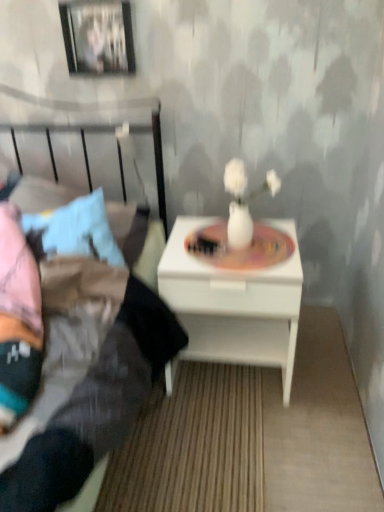
Locate an element on the screen. The width and height of the screenshot is (384, 512). matte black bed at left is located at coordinates (83, 378).

Find the location of a particular element. matte black bed at left is located at coordinates (83, 378).

Is metallic silver picture frame at upper left located outside matte black bed at left?

Indeed, metallic silver picture frame at upper left is completely outside matte black bed at left.

Which of these two, metallic silver picture frame at upper left or matte black bed at left, stands shorter?

metallic silver picture frame at upper left is shorter.

From the picture: From a real-world perspective, between metallic silver picture frame at upper left and matte black bed at left, who is vertically higher?

metallic silver picture frame at upper left, from a real-world perspective.

Is metallic silver picture frame at upper left aimed at matte black bed at left?

No, metallic silver picture frame at upper left does not turn towards matte black bed at left.

Who is taller, matte white vase at center or metallic silver picture frame at upper left?

With more height is metallic silver picture frame at upper left.

This screenshot has width=384, height=512. In order to click on picture frame above the matte white vase at center (from the image's perspective) in this screenshot , I will do `click(98, 37)`.

Considering the relative sizes of matte white vase at center and metallic silver picture frame at upper left in the image provided, is matte white vase at center bigger than metallic silver picture frame at upper left?

No.

Which object is positioned more to the right, metallic silver picture frame at upper left or matte white vase at center?

matte white vase at center is more to the right.

Is metallic silver picture frame at upper left not near matte white vase at center?

That's not correct — metallic silver picture frame at upper left is a little close to matte white vase at center.

Considering the sizes of objects metallic silver picture frame at upper left and matte white vase at center in the image provided, who is bigger, metallic silver picture frame at upper left or matte white vase at center?

Bigger between the two is metallic silver picture frame at upper left.

From the image's perspective, which is above, metallic silver picture frame at upper left or matte white vase at center?

metallic silver picture frame at upper left appears higher in the image.

Consider the image. Is matte black bed at left to the right of matte white vase at center from the viewer's perspective?

No.

Is matte black bed at left smaller than matte white vase at center?

No.

Are matte black bed at left and matte white vase at center making contact?

No, matte black bed at left is not making contact with matte white vase at center.

What's the angular difference between white glossy nightstand at center and metallic silver picture frame at upper left's facing directions?

There is a 0.855-degree angle between the facing directions of white glossy nightstand at center and metallic silver picture frame at upper left.

From a real-world perspective, is white glossy nightstand at center below metallic silver picture frame at upper left?

Yes, from a real-world perspective, white glossy nightstand at center is under metallic silver picture frame at upper left.

Locate an element on the screen. The height and width of the screenshot is (512, 384). picture frame above the white glossy nightstand at center (from the image's perspective) is located at coordinates (98, 37).

Is matte black bed at left located outside metallic silver picture frame at upper left?

That's correct, matte black bed at left is outside of metallic silver picture frame at upper left.

Consider the image. From a real-world perspective, is matte black bed at left positioned above or below metallic silver picture frame at upper left?

From a real-world perspective, matte black bed at left is physically below metallic silver picture frame at upper left.

Is matte black bed at left to the right of metallic silver picture frame at upper left from the viewer's perspective?

In fact, matte black bed at left is to the left of metallic silver picture frame at upper left.

Consider the image. How far apart are matte black bed at left and metallic silver picture frame at upper left?

They are 22.77 inches apart.

From the image's perspective, is metallic silver picture frame at upper left positioned above or below white glossy nightstand at center?

metallic silver picture frame at upper left is situated higher than white glossy nightstand at center in the image.

In the scene shown: From a real-world perspective, who is located higher, metallic silver picture frame at upper left or white glossy nightstand at center?

In real-world perspective, metallic silver picture frame at upper left is above.

Is metallic silver picture frame at upper left beside white glossy nightstand at center?

No, metallic silver picture frame at upper left is not touching white glossy nightstand at center.

Find the location of `picture frame to the right of matte black bed at left`. picture frame to the right of matte black bed at left is located at coordinates (98, 37).

In order to click on picture frame above the matte white vase at center (from the image's perspective) in this screenshot , I will do `click(98, 37)`.

Looking at the image, which one is located further to matte white vase at center, metallic silver picture frame at upper left or white glossy nightstand at center?

metallic silver picture frame at upper left.

Estimate the real-world distances between objects in this image. Which object is closer to white glossy nightstand at center, metallic silver picture frame at upper left or matte black bed at left?

The object closer to white glossy nightstand at center is matte black bed at left.

When comparing their distances from matte black bed at left, does metallic silver picture frame at upper left or matte white vase at center seem further?

metallic silver picture frame at upper left is positioned further to the anchor matte black bed at left.

When comparing their distances from white glossy nightstand at center, does matte white vase at center or metallic silver picture frame at upper left seem further?

Based on the image, metallic silver picture frame at upper left appears to be further to white glossy nightstand at center.

Estimate the real-world distances between objects in this image. Which object is further from white glossy nightstand at center, metallic silver picture frame at upper left or matte white vase at center?

metallic silver picture frame at upper left is further to white glossy nightstand at center.

Estimate the real-world distances between objects in this image. Which object is closer to white glossy nightstand at center, matte black bed at left or matte white vase at center?

matte white vase at center lies closer to white glossy nightstand at center than the other object.

From the image, which object appears to be nearer to matte white vase at center, white glossy nightstand at center or matte black bed at left?

Based on the image, white glossy nightstand at center appears to be nearer to matte white vase at center.

Estimate the real-world distances between objects in this image. Which object is closer to metallic silver picture frame at upper left, white glossy nightstand at center or matte black bed at left?

Based on the image, matte black bed at left appears to be nearer to metallic silver picture frame at upper left.

You are a GUI agent. You are given a task and a screenshot of the screen. Output one action in this format:
    pyautogui.click(x=<x>, y=<y>)
    Task: Click on the nightstand between matte black bed at left and matte white vase at center from front to back
    
    Given the screenshot: What is the action you would take?
    pyautogui.click(x=234, y=303)

This screenshot has height=512, width=384. Identify the location of round table between metallic silver picture frame at upper left and white glossy nightstand at center from top to bottom. (241, 249).

The width and height of the screenshot is (384, 512). I want to click on round table between matte black bed at left and metallic silver picture frame at upper left from front to back, so click(241, 249).

Locate an element on the screen. The width and height of the screenshot is (384, 512). nightstand positioned between matte black bed at left and metallic silver picture frame at upper left from near to far is located at coordinates (234, 303).